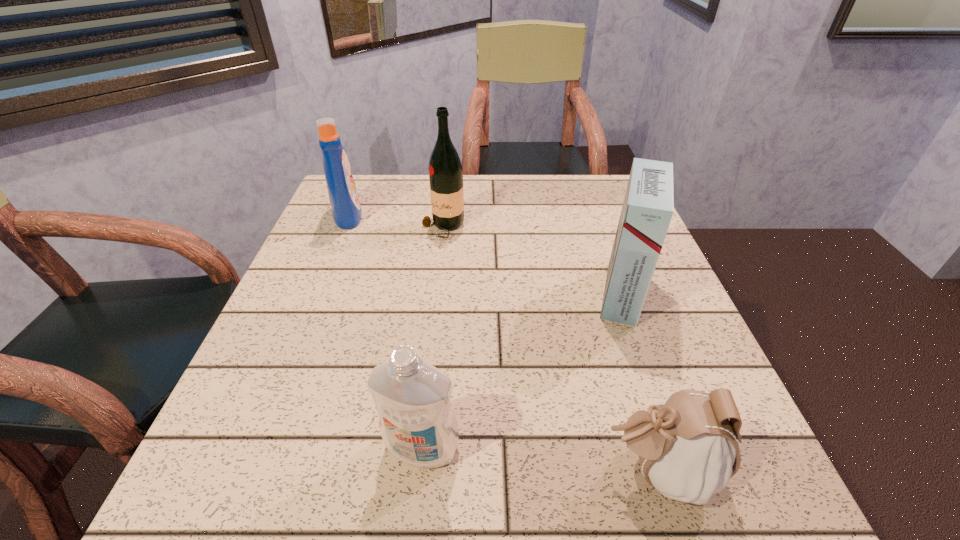
At what (x,y) coordinates should I click in order to perform the action: click on free space between the nearer detergent and the wine bottle. Please return your answer as a coordinate pair (x, y). The width and height of the screenshot is (960, 540). Looking at the image, I should click on (433, 338).

Where is `free space between the shortest object and the cigarette case`? free space between the shortest object and the cigarette case is located at coordinates (639, 382).

This screenshot has height=540, width=960. In order to click on free space between the leftmost object and the cigarette case in this screenshot , I will do `click(485, 254)`.

Identify the location of vacant space that is in between the cigarette case and the shorter detergent. (522, 370).

Locate an element on the screen. The image size is (960, 540). empty space that is in between the pouch and the leftmost object is located at coordinates (503, 343).

The width and height of the screenshot is (960, 540). I want to click on empty location between the third farthest object and the leftmost object, so click(485, 254).

Identify the location of vacant space that's between the wine bottle and the shorter detergent. The image size is (960, 540). (433, 338).

In order to click on free space between the left detergent and the right detergent in this screenshot , I will do `click(385, 331)`.

Identify which object is located as the third nearest to the farther detergent. Please provide its 2D coordinates. Your answer should be formatted as a tuple, i.e. [(x, y)], where the tuple contains the x and y coordinates of a point satisfying the conditions above.

[(648, 207)]

Select which object is the second closest to the wine bottle. Please provide its 2D coordinates. Your answer should be formatted as a tuple, i.e. [(x, y)], where the tuple contains the x and y coordinates of a point satisfying the conditions above.

[(648, 207)]